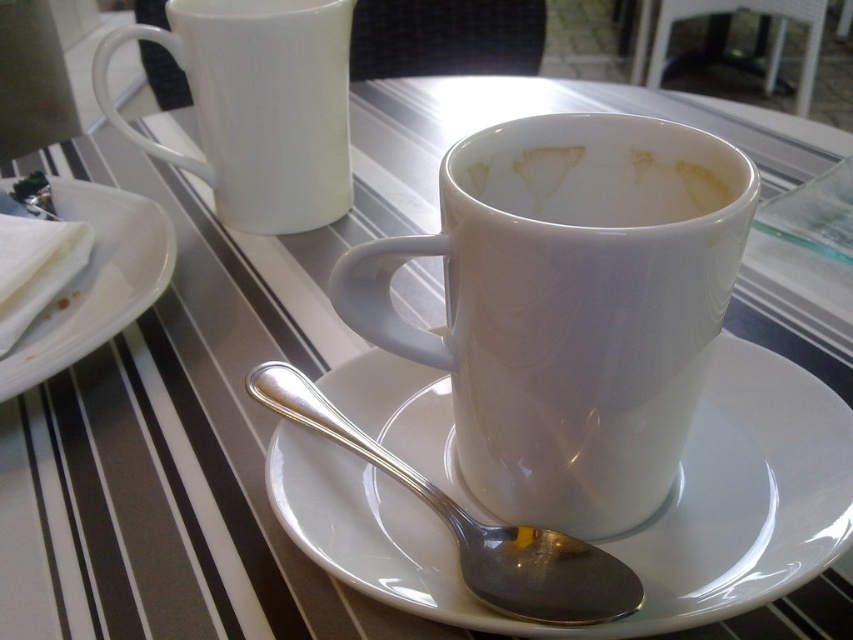
Is glossy ceramic mug at center closer to the viewer compared to white glossy cup at center?

Yes, it is in front of white glossy cup at center.

Is point (585, 266) in front of point (517, 202)?

Yes, point (585, 266) is closer to viewer.

This screenshot has width=853, height=640. Find the location of `glossy ceramic mug at center`. glossy ceramic mug at center is located at coordinates (569, 307).

Which is more to the left, white ceramic saucer at center or white glossy cup at center?

Positioned to the left is white ceramic saucer at center.

What do you see at coordinates (622, 534) in the screenshot? The width and height of the screenshot is (853, 640). I see `white ceramic saucer at center` at bounding box center [622, 534].

I want to click on white ceramic saucer at center, so click(x=622, y=534).

Does white ceramic saucer at center appear over white glossy mug at upper center?

No, white ceramic saucer at center is not above white glossy mug at upper center.

Is white ceramic saucer at center bigger than white glossy mug at upper center?

Incorrect, white ceramic saucer at center is not larger than white glossy mug at upper center.

At what (x,y) coordinates should I click in order to perform the action: click on white ceramic saucer at center. Please return your answer as a coordinate pair (x, y). The height and width of the screenshot is (640, 853). Looking at the image, I should click on (622, 534).